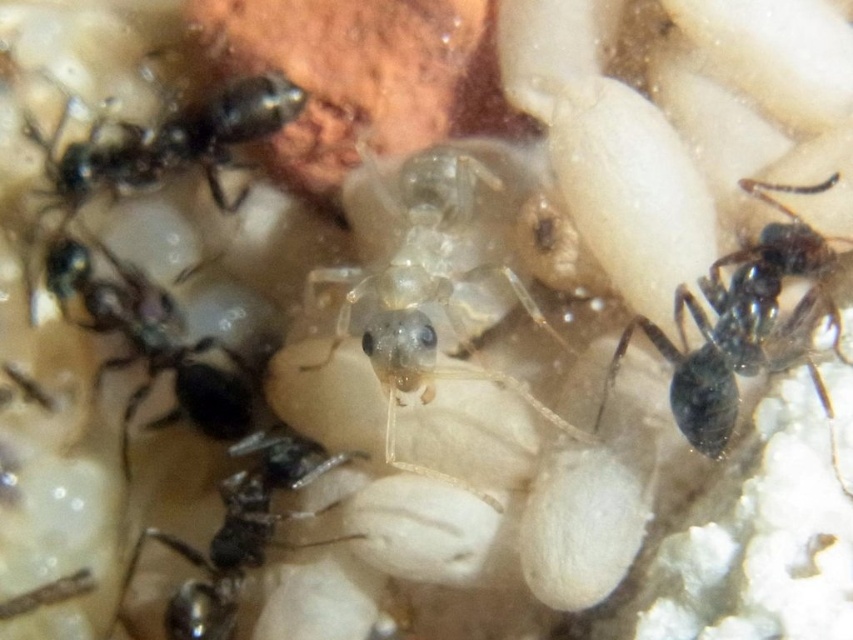
Question: Can you confirm if translucent gelatinous ant at center is smaller than black glossy ant at right?

Choices:
 (A) yes
 (B) no

Answer: (B)

Question: Among these objects, which one is nearest to the camera?

Choices:
 (A) black glossy ant at lower left
 (B) shiny black ant at upper left
 (C) translucent gelatinous ant at center
 (D) black glossy ant at right

Answer: (D)

Question: Which object is closer to the camera taking this photo?

Choices:
 (A) translucent gelatinous ant at center
 (B) black glossy ant at center
 (C) black glossy ant at right
 (D) black glossy ant at lower left

Answer: (C)

Question: Does translucent gelatinous ant at center lie in front of black glossy ant at lower left?

Choices:
 (A) yes
 (B) no

Answer: (A)

Question: Which object is farther from the camera taking this photo?

Choices:
 (A) translucent gelatinous ant at center
 (B) black glossy ant at lower left
 (C) black glossy ant at center
 (D) shiny black ant at upper left

Answer: (D)

Question: Does black glossy ant at right have a lesser width compared to black glossy ant at center?

Choices:
 (A) yes
 (B) no

Answer: (A)